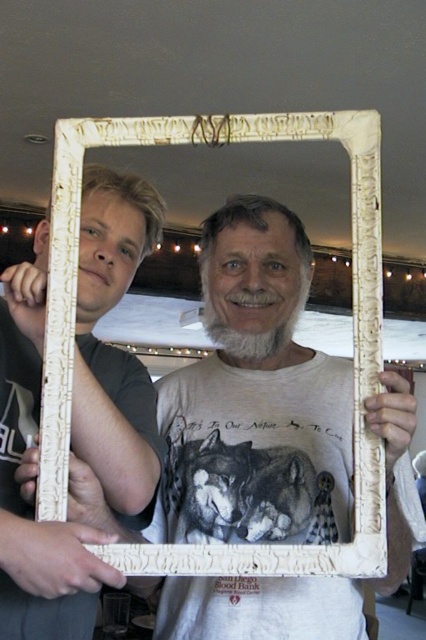
You are an interior designer assessing the placement of two frames in a room. The matte white frame at left and the white wood picture frame at center are both on the same wall. Which frame has a greater height?

The matte white frame at left is taller than the white wood picture frame at center.

You are an interior designer planning to place a decorative item between the matte white frame at left and the white wood picture frame at center. The item you want to place is 5 inches wide. Will there be enough space between them to fit the item?

The matte white frame at left and white wood picture frame at center are 5.60 inches apart. Since the item is 5 inches wide, there will be enough space to fit it between them as 5 inches is less than 5.60 inches.